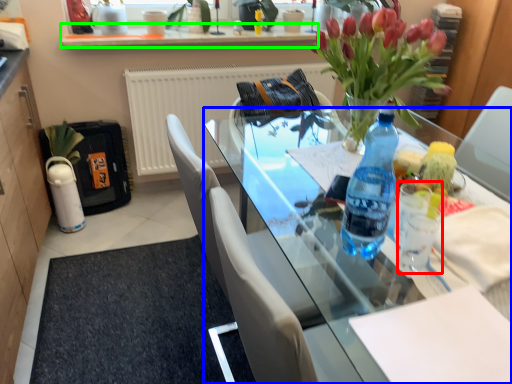
Question: Which object is the closest to the coffee cup (highlighted by a red box)? Choose among these: desk (highlighted by a blue box) or window sill (highlighted by a green box).

Choices:
 (A) desk
 (B) window sill

Answer: (A)